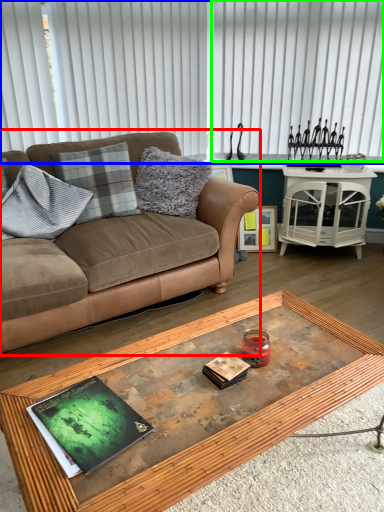
Question: Based on their relative distances, which object is farther from studio couch (highlighted by a red box)? Choose from blind (highlighted by a blue box) and blind (highlighted by a green box).

Choices:
 (A) blind
 (B) blind

Answer: (B)